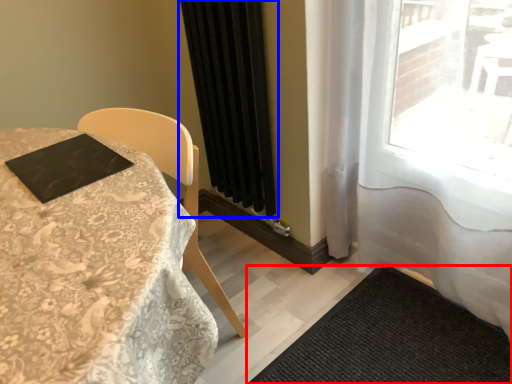
Question: Which point is closer to the camera, doormat (highlighted by a red box) or curtain (highlighted by a blue box)?

Choices:
 (A) doormat
 (B) curtain

Answer: (A)